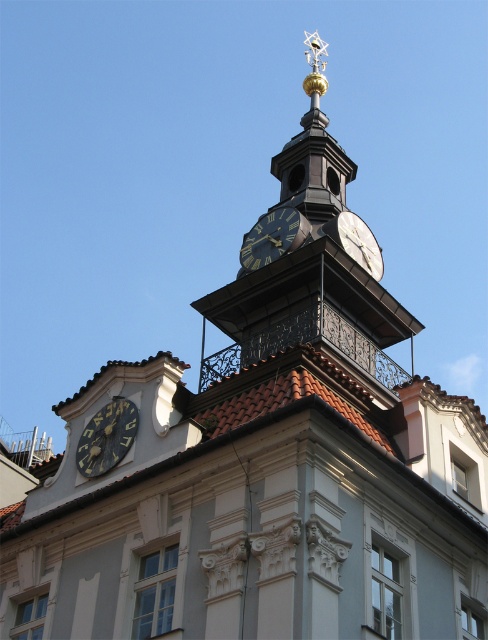
You are standing at the base of the clock tower and notice two points marked on the tower. The first point is at coordinates point [94,436] and the second is at point [359,236]. From your vantage point, which point appears closer to you?

Point [94,436] is in front of point [359,236], so it appears closer to you.

You are an architect designing a new building and want to ensure that the dark brown wooden clock at lower left and the gold metallic clock at upper center are proportionate to each other. Based on the scene, which clock should be placed higher to maintain visual balance?

The gold metallic clock at upper center should be placed higher because it is taller than the dark brown wooden clock at lower left, so positioning it higher helps maintain visual balance.